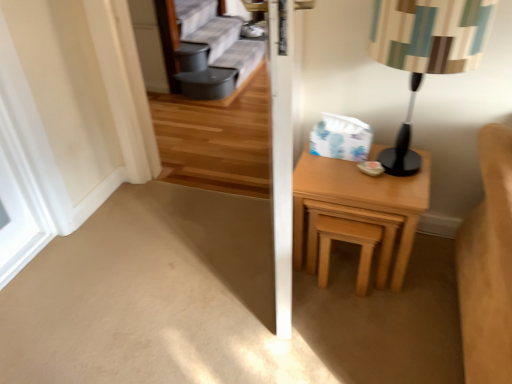
The image size is (512, 384). Find the location of `vacant space that's between light brown wooden stool at right and white matte window at left`. vacant space that's between light brown wooden stool at right and white matte window at left is located at coordinates (192, 241).